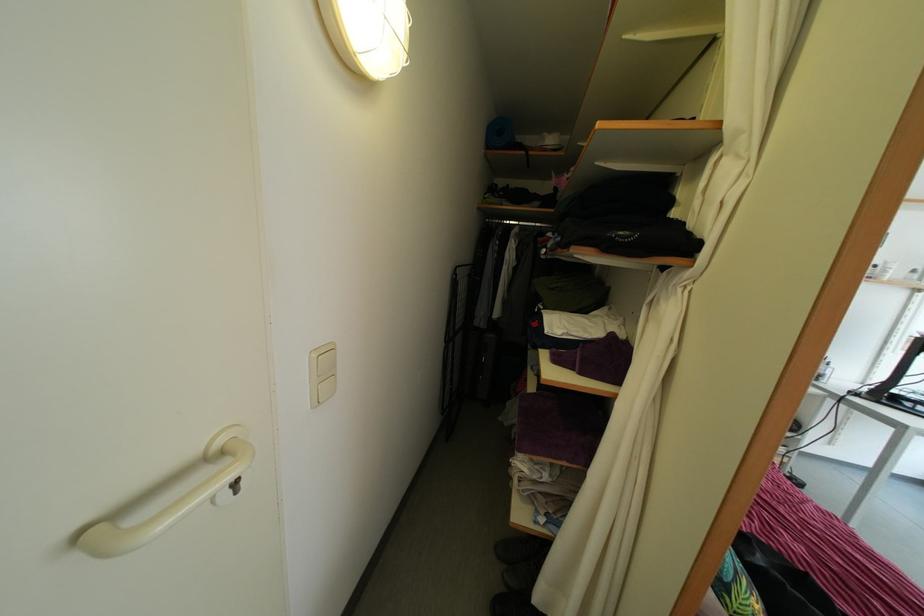
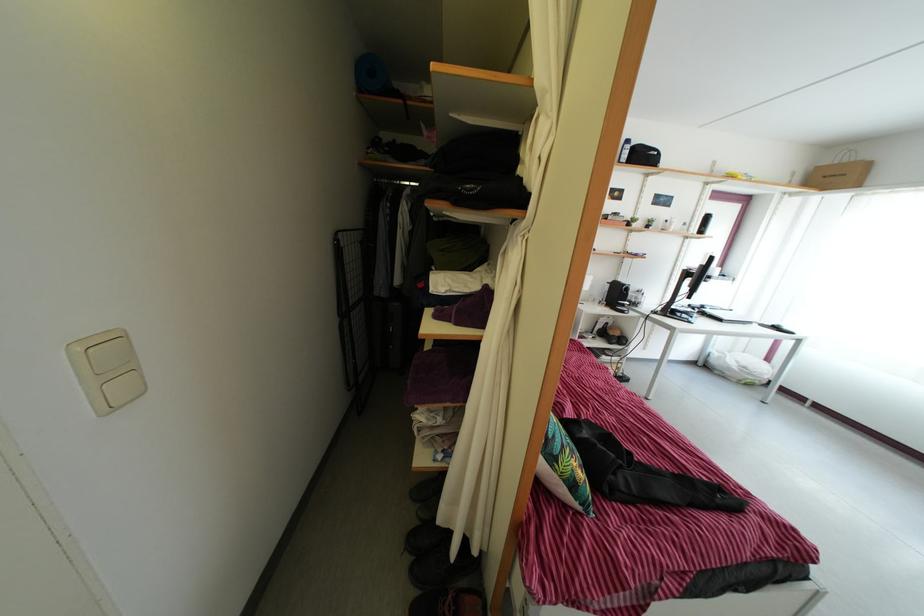
Question: The images are taken continuously from a first-person perspective. In which direction is your viewpoint rotating?

Choices:
 (A) Left
 (B) Right
 (C) Up
 (D) Down

Answer: (B)